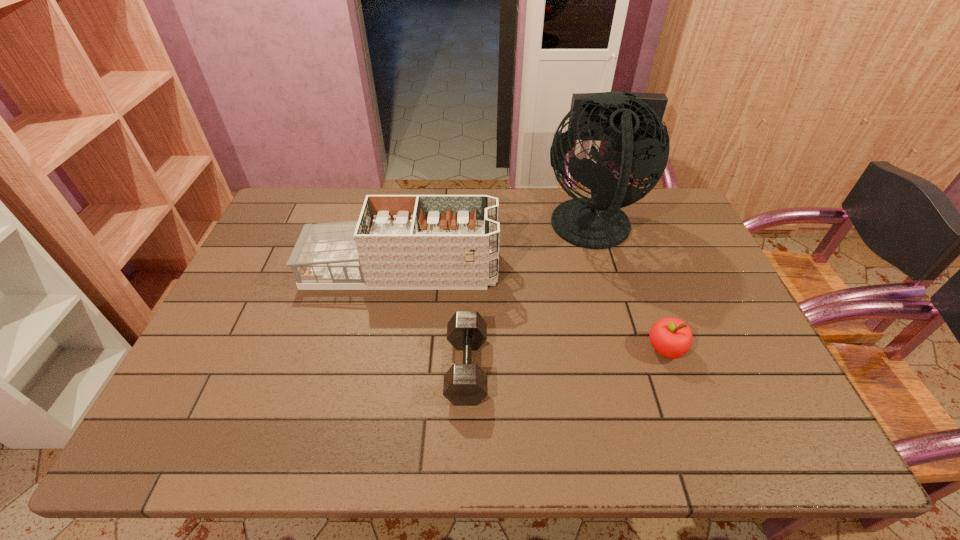
Locate an element on the screen. The image size is (960, 540). blank region between the dumbbell and the tallest object is located at coordinates (529, 299).

The image size is (960, 540). I want to click on unoccupied position between the globe and the shortest object, so click(529, 299).

Where is `vacant area between the tallest object and the shortest object`? vacant area between the tallest object and the shortest object is located at coordinates (529, 299).

Locate an element on the screen. The image size is (960, 540). empty space that is in between the globe and the second shortest object is located at coordinates (629, 290).

Locate an element on the screen. free space between the shortest object and the third shortest object is located at coordinates (434, 319).

Identify which object is located as the nearest to the apple. Please provide its 2D coordinates. Your answer should be formatted as a tuple, i.e. [(x, y)], where the tuple contains the x and y coordinates of a point satisfying the conditions above.

[(634, 129)]

Where is `object that stands as the closest to the globe`? The width and height of the screenshot is (960, 540). object that stands as the closest to the globe is located at coordinates pos(401,242).

This screenshot has height=540, width=960. In order to click on free space that satisfies the following two spatial constraints: 1. on the front-facing side of the tallest object; 2. on the left side of the second shortest object in this screenshot , I will do (x=626, y=349).

In order to click on free space that satisfies the following two spatial constraints: 1. on the front-facing side of the apple; 2. on the right side of the globe in this screenshot , I will do `click(626, 349)`.

Where is `free space in the image that satisfies the following two spatial constraints: 1. on the front-facing side of the second shortest object; 2. on the right side of the globe`? The image size is (960, 540). free space in the image that satisfies the following two spatial constraints: 1. on the front-facing side of the second shortest object; 2. on the right side of the globe is located at coordinates (626, 349).